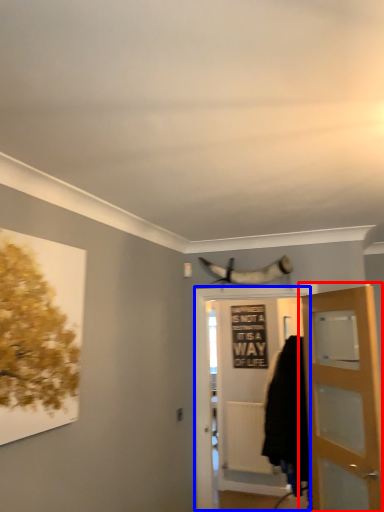
Question: Among these objects, which one is nearest to the camera, door (highlighted by a red box) or door (highlighted by a blue box)?

Choices:
 (A) door
 (B) door

Answer: (A)